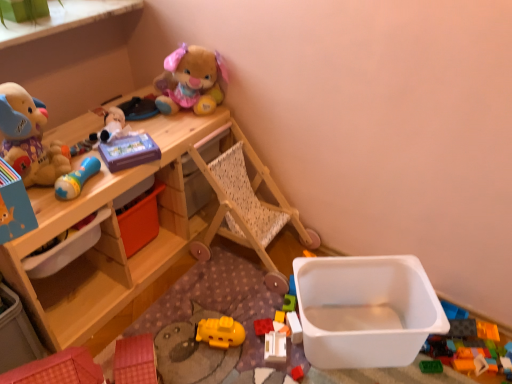
Locate an element on the screen. The image size is (512, 384). vacant area that lies between blue rubber rattle at upper left, the fourth toy positioned from the top, and purple matte tissue box at upper center, marked as the seventh toy in a bottom-to-top arrangement is located at coordinates (106, 183).